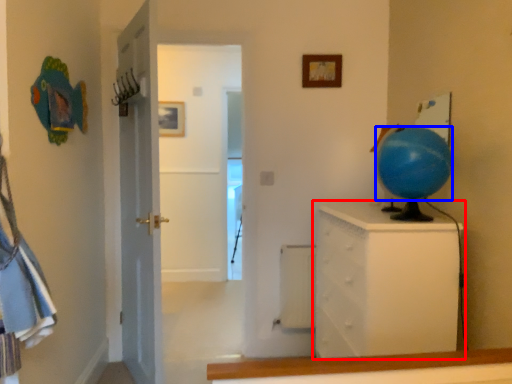
Question: Which of the following is the closest to the observer, chest of drawers (highlighted by a red box) or balloon (highlighted by a blue box)?

Choices:
 (A) chest of drawers
 (B) balloon

Answer: (B)